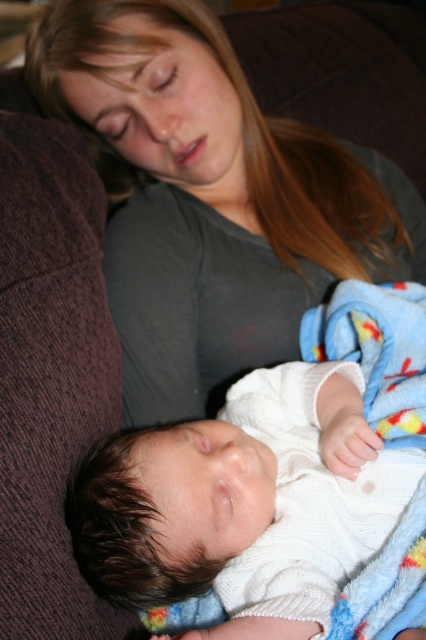
Between point (36, 77) and point (213, 493), which one is positioned in front?

Positioned in front is point (213, 493).

Can you confirm if matte gray shirt at upper center is taller than white knitted sweater at center?

Yes, matte gray shirt at upper center is taller than white knitted sweater at center.

Does point (215, 284) come closer to viewer compared to point (382, 509)?

No, (215, 284) is behind (382, 509).

At what (x,y) coordinates should I click in order to perform the action: click on matte gray shirt at upper center. Please return your answer as a coordinate pair (x, y). This screenshot has width=426, height=640. Looking at the image, I should click on (210, 198).